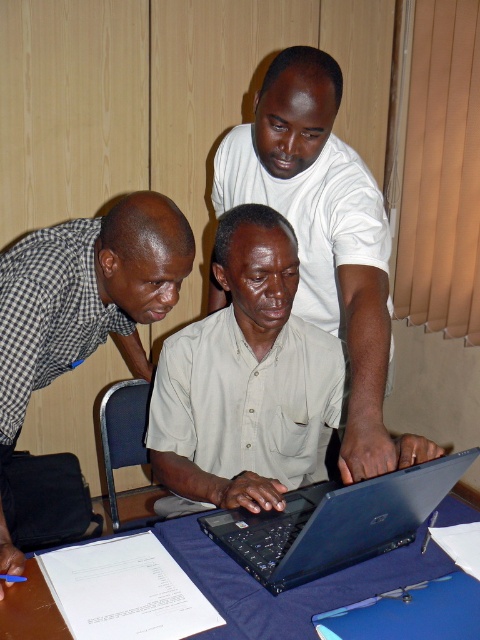
Does checkered fabric shirt at left have a larger size compared to black plastic laptop at center?

Yes.

Which is behind, point (32, 321) or point (282, 582)?

Positioned behind is point (32, 321).

Between point (104, 220) and point (359, 557), which one is positioned in front?

Point (359, 557) is more forward.

This screenshot has height=640, width=480. I want to click on checkered fabric shirt at left, so click(x=90, y=291).

In the scene shown: Measure the distance between white matte shirt at center and checkered fabric shirt at left.

17.20 inches

Between white matte shirt at center and checkered fabric shirt at left, which one is positioned lower?

Positioned lower is checkered fabric shirt at left.

This screenshot has height=640, width=480. What do you see at coordinates (324, 234) in the screenshot?
I see `white matte shirt at center` at bounding box center [324, 234].

At what (x,y) coordinates should I click in order to perform the action: click on white matte shirt at center. Please return your answer as a coordinate pair (x, y). The image size is (480, 640). Looking at the image, I should click on (324, 234).

From the picture: Who is positioned more to the left, white matte shirt at center or black plastic laptop at center?

From the viewer's perspective, black plastic laptop at center appears more on the left side.

Does point (273, 138) lie in front of point (305, 506)?

No, it is not.

The image size is (480, 640). In order to click on white matte shirt at center in this screenshot , I will do `click(324, 234)`.